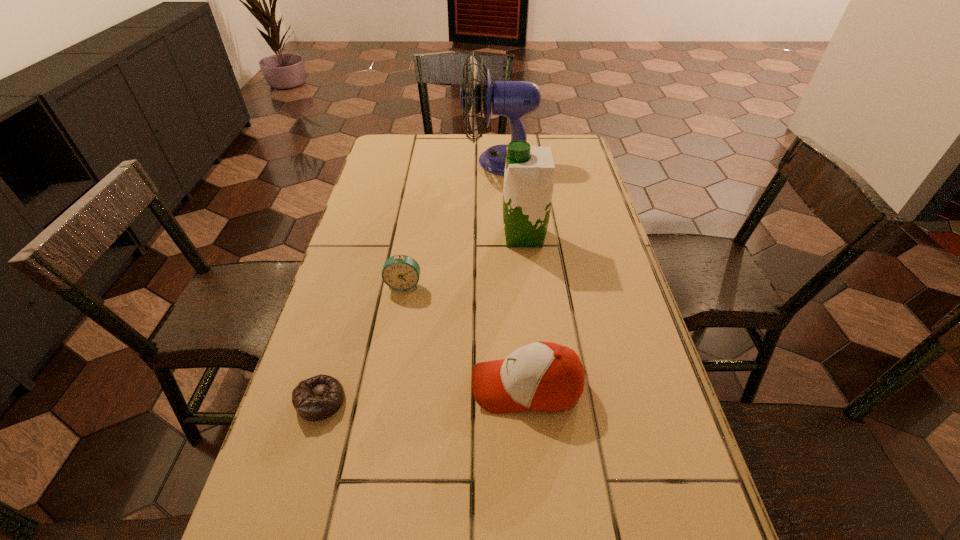
Locate an element on the screen. The image size is (960, 540). free space between the baseball cap and the alarm clock is located at coordinates (466, 336).

Identify the location of free space that is in between the fourth object from right to left and the fourth nearest object. Image resolution: width=960 pixels, height=540 pixels. (464, 261).

Where is `free spot between the fourth shortest object and the baseball cap`? The height and width of the screenshot is (540, 960). free spot between the fourth shortest object and the baseball cap is located at coordinates (525, 312).

Find the location of `free spot between the fourth nearest object and the shortest object`. free spot between the fourth nearest object and the shortest object is located at coordinates (422, 318).

The image size is (960, 540). Find the location of `free space that is in between the fan and the baseball cap`. free space that is in between the fan and the baseball cap is located at coordinates (514, 274).

Locate an element on the screen. This screenshot has width=960, height=540. object that is the fourth closest to the second shortest object is located at coordinates (514, 99).

Locate an element on the screen. The width and height of the screenshot is (960, 540). object that is the closest to the baseball cap is located at coordinates (400, 272).

The width and height of the screenshot is (960, 540). I want to click on vacant region that satisfies the following two spatial constraints: 1. on the front-facing side of the second tallest object; 2. on the front-facing side of the third farthest object, so click(x=529, y=285).

You are a GUI agent. You are given a task and a screenshot of the screen. Output one action in this format:
    pyautogui.click(x=<x>, y=<y>)
    Task: Click on the vacant space that satisfies the following two spatial constraints: 1. on the front-facing side of the soya milk; 2. on the front-facing side of the second object from left to right
    This screenshot has height=540, width=960.
    Given the screenshot: What is the action you would take?
    pyautogui.click(x=529, y=285)

You are a GUI agent. You are given a task and a screenshot of the screen. Output one action in this format:
    pyautogui.click(x=<x>, y=<y>)
    Task: Click on the free space that satisfies the following two spatial constraints: 1. on the front-facing side of the soya milk; 2. on the front-facing side of the fourth tallest object
    The image size is (960, 540).
    Given the screenshot: What is the action you would take?
    pyautogui.click(x=529, y=285)